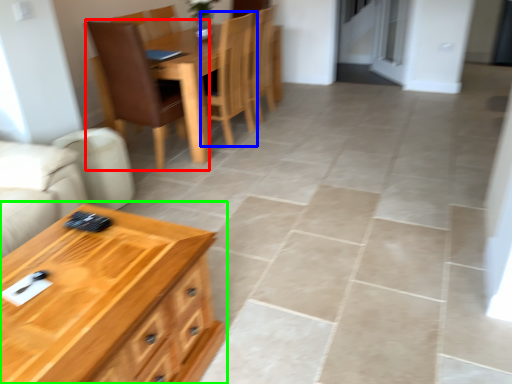
Question: Which object is the closest to the chair (highlighted by a red box)? Choose among these: chair (highlighted by a blue box) or table (highlighted by a green box).

Choices:
 (A) chair
 (B) table

Answer: (A)